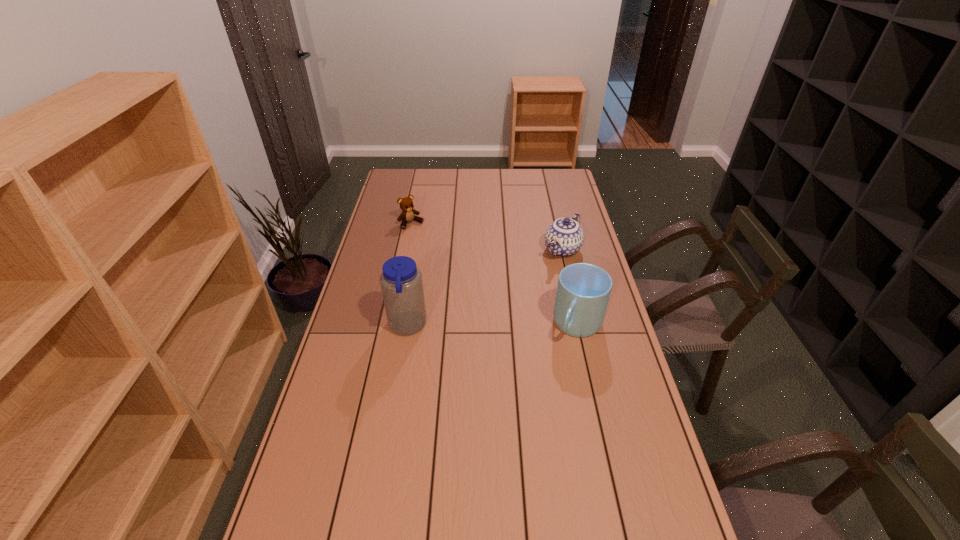
Where is `free spot on the desktop that is between the water bottle and the second tallest object and is positioned from the spout of the third nearest object`? The height and width of the screenshot is (540, 960). free spot on the desktop that is between the water bottle and the second tallest object and is positioned from the spout of the third nearest object is located at coordinates (486, 326).

Where is `free space on the desktop that is between the tallest object and the second tallest object and is positioned on the front-facing side of the teddy bear`? free space on the desktop that is between the tallest object and the second tallest object and is positioned on the front-facing side of the teddy bear is located at coordinates (511, 326).